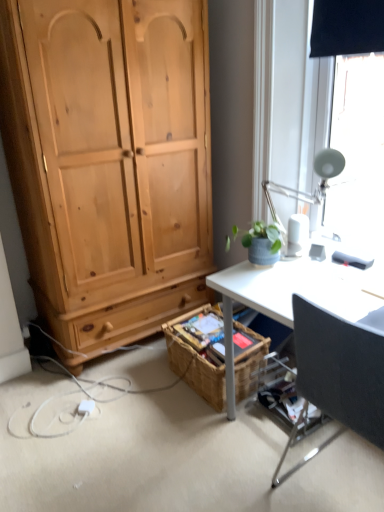
Question: From a real-world perspective, relative to white metallic lamp at upper right, is woven brown picnic basket at lower center vertically above or below?

Choices:
 (A) below
 (B) above

Answer: (A)

Question: Is woven brown picnic basket at lower center bigger or smaller than white metallic lamp at upper right?

Choices:
 (A) big
 (B) small

Answer: (A)

Question: Considering the real-world distances, which object is farthest from the woven brown picnic basket at lower center?

Choices:
 (A) white metallic lamp at upper right
 (B) white plastic power outlet at lower left
 (C) green matte plant pot at upper right
 (D) black fabric chair at right

Answer: (A)

Question: Which of these objects is positioned farthest from the white metallic lamp at upper right?

Choices:
 (A) woven brown picnic basket at lower center
 (B) white plastic power outlet at lower left
 (C) green matte plant pot at upper right
 (D) black fabric chair at right

Answer: (B)